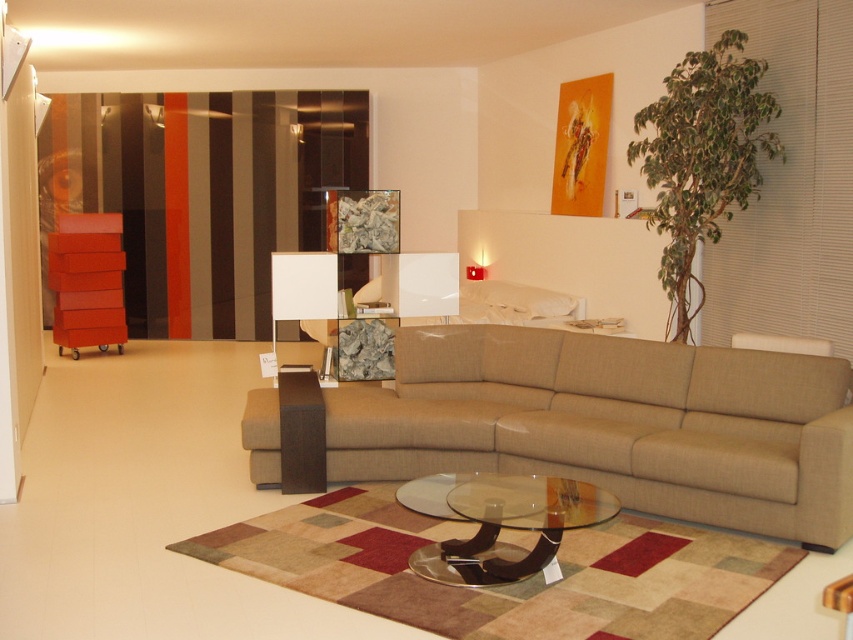
You are a guest entering the living room and want to sit down. Which object, the beige fabric couch at center or the transparent glass coffee table at center, is more suitable for sitting?

The beige fabric couch at center is taller than the transparent glass coffee table at center, so it is more suitable for sitting as it has a height appropriate for seating.

Looking at this image, you are standing in the living room and want to move from the entrance to the window located behind the beige fabric couch at center. Can you walk directly behind the transparent glass coffee table at center to reach the window without moving any furniture?

The beige fabric couch at center is further to the viewer than the transparent glass coffee table at center, so the couch is closer to you. This means the coffee table is behind the couch. Since the couch is in front of the coffee table, you would need to move around the couch to access the area behind the coffee table towards the window.

You are arranging a small plant stand between the beige fabric couch at center and the transparent glass coffee table at center. Which object should the plant stand be closer to if it needs to be placed closer to the wider object?

The plant stand should be placed closer to the beige fabric couch at center because its width is greater than that of the transparent glass coffee table at center.